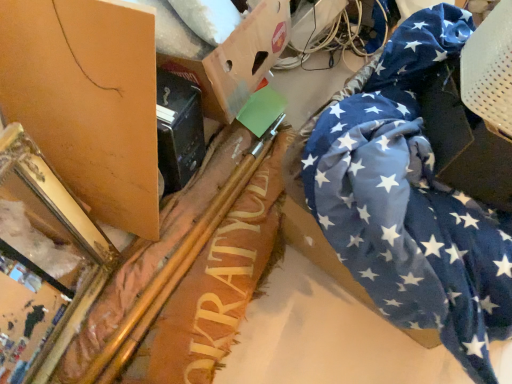
Question: From a real-world perspective, is gold metallic mirror at left positioned under green plastic wire at upper center based on gravity?

Choices:
 (A) yes
 (B) no

Answer: (B)

Question: Is green plastic wire at upper center surrounded by gold metallic mirror at left?

Choices:
 (A) yes
 (B) no

Answer: (B)

Question: Does gold metallic mirror at left appear on the left side of green plastic wire at upper center?

Choices:
 (A) no
 (B) yes

Answer: (B)

Question: Is the depth of gold metallic mirror at left less than that of green plastic wire at upper center?

Choices:
 (A) yes
 (B) no

Answer: (A)

Question: Can you confirm if gold metallic mirror at left is taller than green plastic wire at upper center?

Choices:
 (A) no
 (B) yes

Answer: (B)

Question: Which is correct: matte brown cardboard at upper left, which appears as the third cardboard box when viewed from the right, is inside green plastic wire at upper center, or outside of it?

Choices:
 (A) outside
 (B) inside

Answer: (A)

Question: In terms of size, does matte brown cardboard at upper left, the 1th cardboard box when ordered from left to right, appear bigger or smaller than green plastic wire at upper center?

Choices:
 (A) small
 (B) big

Answer: (A)

Question: Looking at their shapes, would you say matte brown cardboard at upper left, the 1th cardboard box when ordered from left to right, is wider or thinner than green plastic wire at upper center?

Choices:
 (A) wide
 (B) thin

Answer: (A)

Question: Considering the positions of point (143, 36) and point (294, 26), is point (143, 36) closer or farther from the camera than point (294, 26)?

Choices:
 (A) farther
 (B) closer

Answer: (B)

Question: Based on their sizes in the image, would you say blue fabric at right, marked as the 3th cardboard box in a left-to-right arrangement, is bigger or smaller than cardboard box at upper center, the second cardboard box when ordered from left to right?

Choices:
 (A) big
 (B) small

Answer: (B)

Question: Is point (471, 183) positioned closer to the camera than point (282, 18)?

Choices:
 (A) closer
 (B) farther

Answer: (A)

Question: From a real-world perspective, is blue fabric at right, positioned as the first cardboard box in right-to-left order, above or below cardboard box at upper center, the second cardboard box when ordered from left to right?

Choices:
 (A) above
 (B) below

Answer: (A)

Question: From the image's perspective, relative to cardboard box at upper center, positioned as the second cardboard box in right-to-left order, is blue fabric at right, positioned as the first cardboard box in right-to-left order, above or below?

Choices:
 (A) above
 (B) below

Answer: (B)

Question: Relative to blue fabric at right, positioned as the first cardboard box in right-to-left order, is green plastic wire at upper center in front or behind?

Choices:
 (A) front
 (B) behind

Answer: (B)

Question: From a real-world perspective, is green plastic wire at upper center physically located above or below blue fabric at right, marked as the 3th cardboard box in a left-to-right arrangement?

Choices:
 (A) above
 (B) below

Answer: (B)